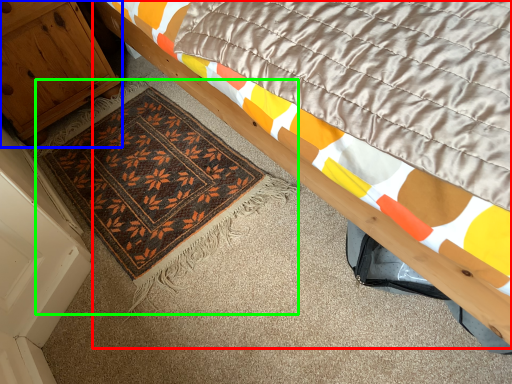
Question: Considering the real-world distances, which object is closest to bed (highlighted by a red box)? cabinetry (highlighted by a blue box) or mat (highlighted by a green box).

Choices:
 (A) cabinetry
 (B) mat

Answer: (B)